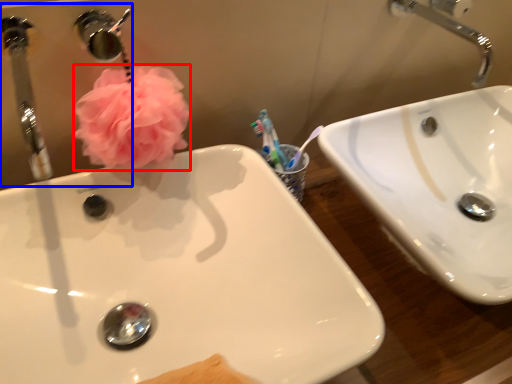
Question: Among these objects, which one is farthest to the camera, flower (highlighted by a red box) or mirror (highlighted by a blue box)?

Choices:
 (A) flower
 (B) mirror

Answer: (A)